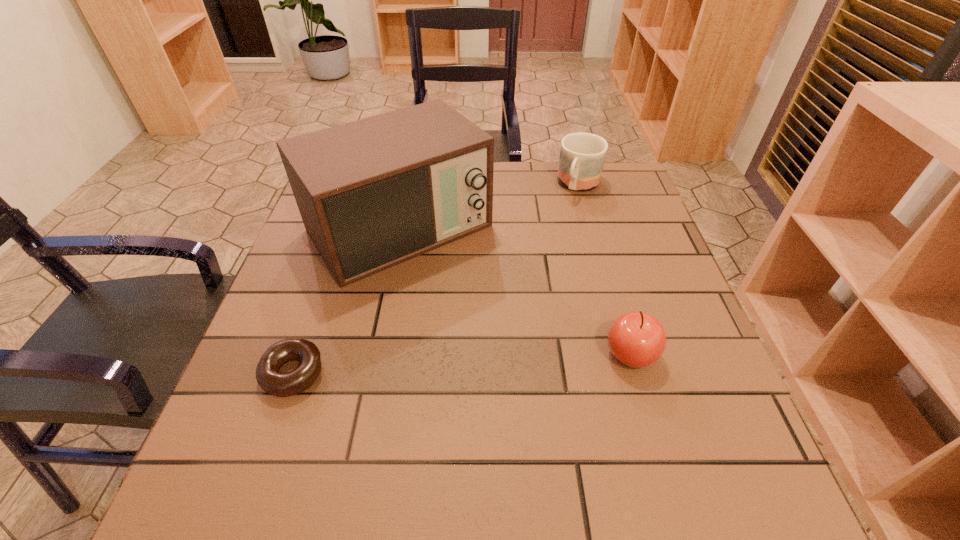
This screenshot has height=540, width=960. Identify the location of blank space located 0.210m on the side with the handle of the mug. (549, 245).

Locate an element on the screen. vacant area situated 0.050m on the side with the handle of the mug is located at coordinates (568, 210).

Where is `radio receiver that is at the far edge`? radio receiver that is at the far edge is located at coordinates (372, 193).

At what (x,y) coordinates should I click in order to perform the action: click on mug at the far edge. Please return your answer as a coordinate pair (x, y). The width and height of the screenshot is (960, 540). Looking at the image, I should click on (582, 155).

You are a GUI agent. You are given a task and a screenshot of the screen. Output one action in this format:
    pyautogui.click(x=<x>, y=<y>)
    Task: Click on the object present at the near edge
    The width and height of the screenshot is (960, 540).
    Given the screenshot: What is the action you would take?
    pyautogui.click(x=276, y=383)

Where is `doughnut that is positioned at the left edge`? doughnut that is positioned at the left edge is located at coordinates (276, 383).

This screenshot has width=960, height=540. What are the coordinates of `radio receiver at the left edge` in the screenshot? It's located at (372, 193).

The height and width of the screenshot is (540, 960). In order to click on apple present at the right edge in this screenshot , I will do `click(636, 339)`.

Identify the location of mug present at the right edge. The height and width of the screenshot is (540, 960). (582, 155).

Where is `object situated at the far left corner`? The image size is (960, 540). object situated at the far left corner is located at coordinates (372, 193).